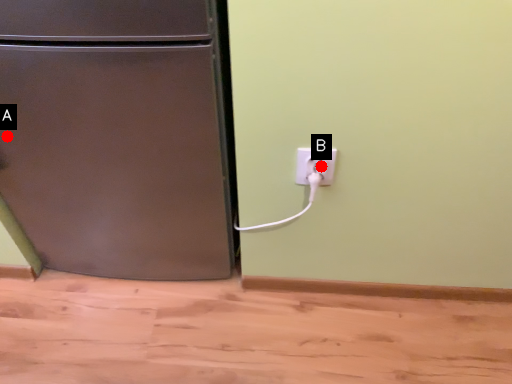
Question: Two points are circled on the image, labeled by A and B beside each circle. Which point appears farthest from the camera in this image?

Choices:
 (A) A is further
 (B) B is further

Answer: (A)